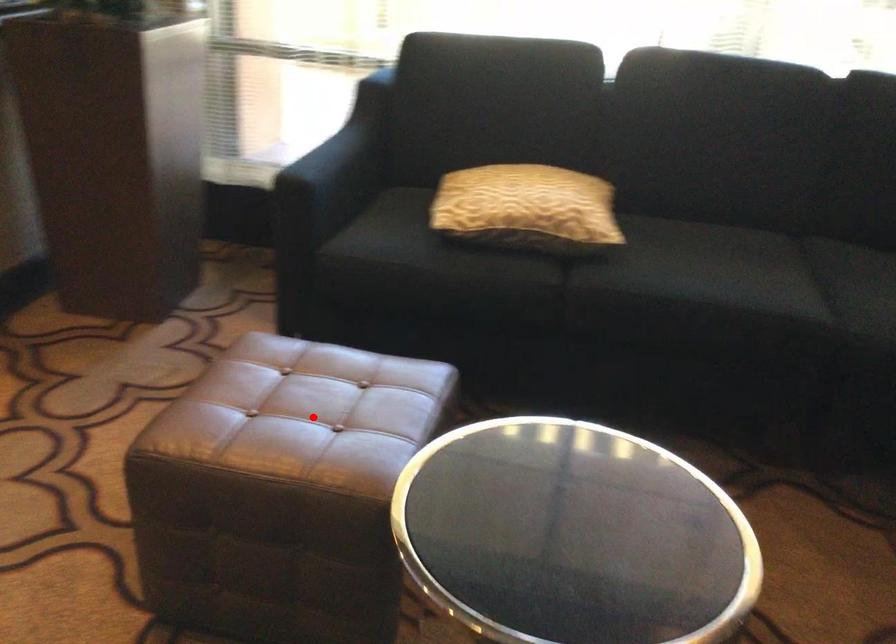
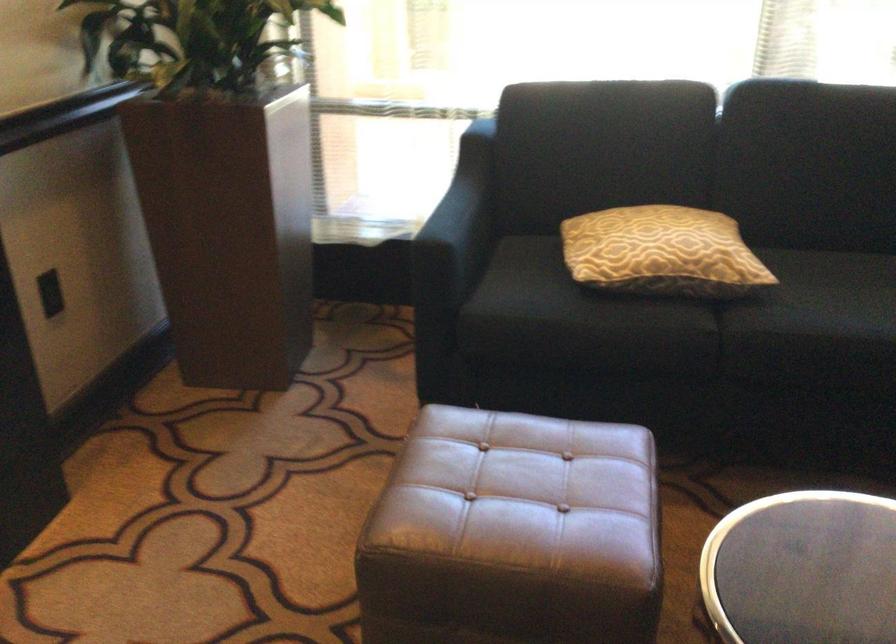
The point at the highlighted location is marked in the first image. Where is the corresponding point in the second image?

(522, 495)